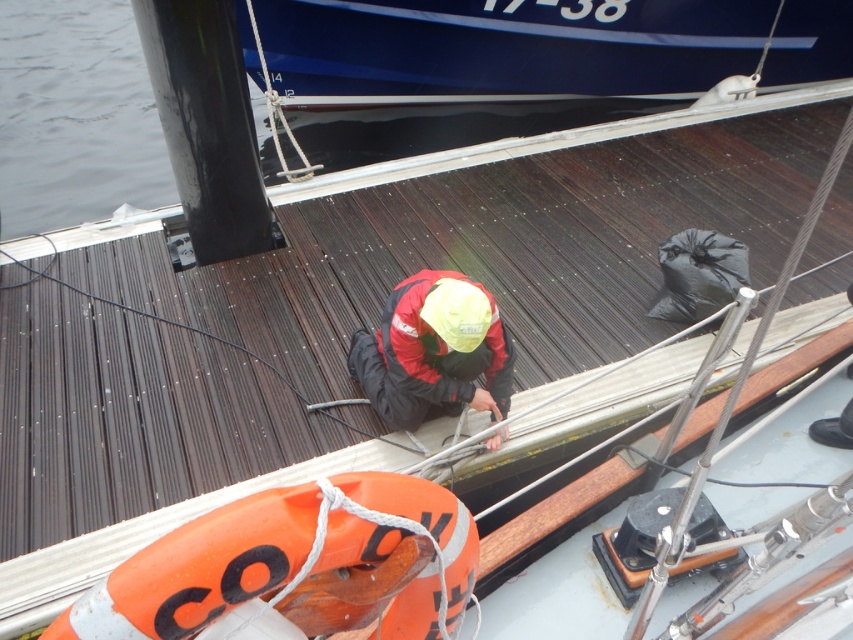
Question: Is orange plastic life jacket at lower center thinner than red matte jacket at center?

Choices:
 (A) yes
 (B) no

Answer: (A)

Question: Where is orange plastic life jacket at lower center located in relation to red matte jacket at center in the image?

Choices:
 (A) above
 (B) below

Answer: (B)

Question: Can you confirm if orange plastic life jacket at lower center is wider than red matte jacket at center?

Choices:
 (A) yes
 (B) no

Answer: (B)

Question: Which point is closer to the camera taking this photo?

Choices:
 (A) (445, 404)
 (B) (357, 536)

Answer: (B)